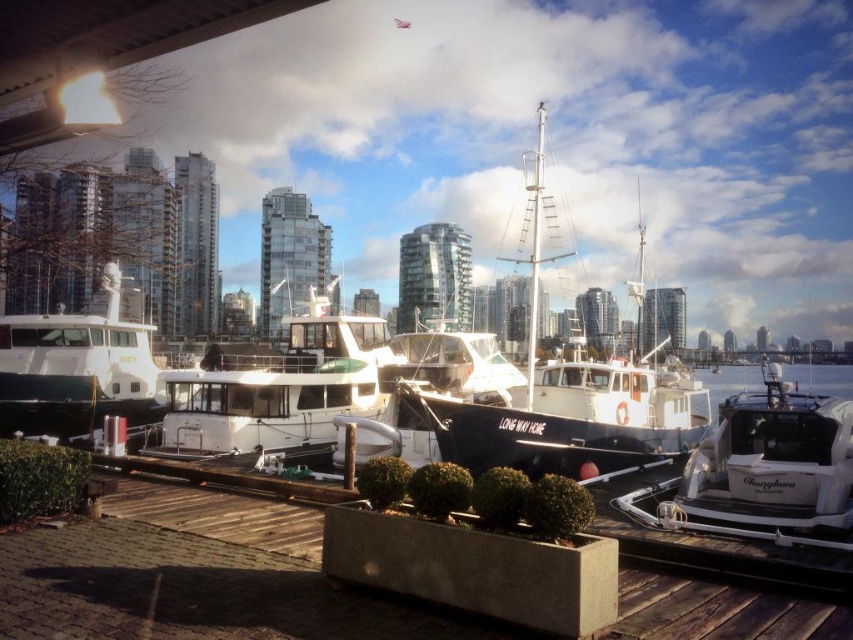
Question: Can you confirm if black matte sailboat at center is positioned below white glossy boat at lower right?

Choices:
 (A) no
 (B) yes

Answer: (A)

Question: Among these objects, which one is farthest from the camera?

Choices:
 (A) white matte boat at center
 (B) black matte sailboat at center

Answer: (A)

Question: Which object is the closest to the white glossy boat at lower right?

Choices:
 (A) wooden dock at center
 (B) white glossy water at center

Answer: (A)

Question: Is wooden dock at center positioned behind white glossy boat at lower right?

Choices:
 (A) no
 (B) yes

Answer: (A)

Question: Which is nearer to the wooden dock at center?

Choices:
 (A) white matte boat at center
 (B) matte white boat at left
 (C) white glossy water at center

Answer: (A)

Question: Where is wooden dock at center located in relation to black matte sailboat at center in the image?

Choices:
 (A) left
 (B) right

Answer: (A)